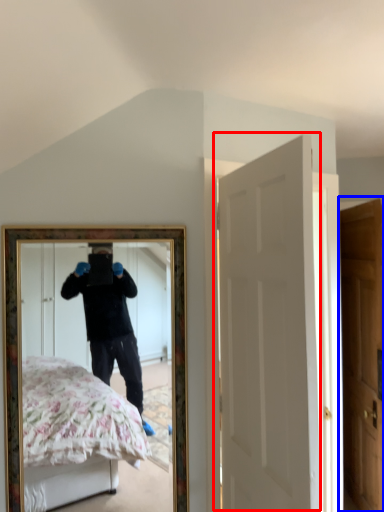
Question: Which point is further to the camera, door (highlighted by a red box) or door (highlighted by a blue box)?

Choices:
 (A) door
 (B) door

Answer: (B)